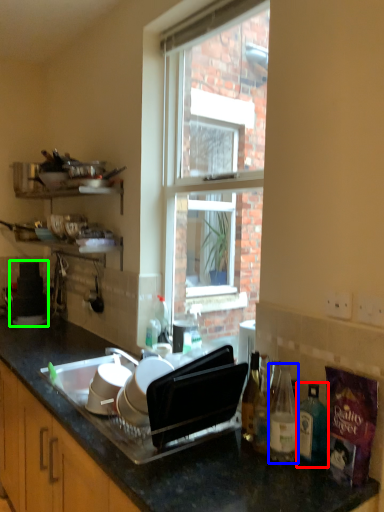
Question: Which object is the closest to the bottle (highlighted by a red box)? Choose among these: bottle (highlighted by a blue box) or appliance (highlighted by a green box).

Choices:
 (A) bottle
 (B) appliance

Answer: (A)